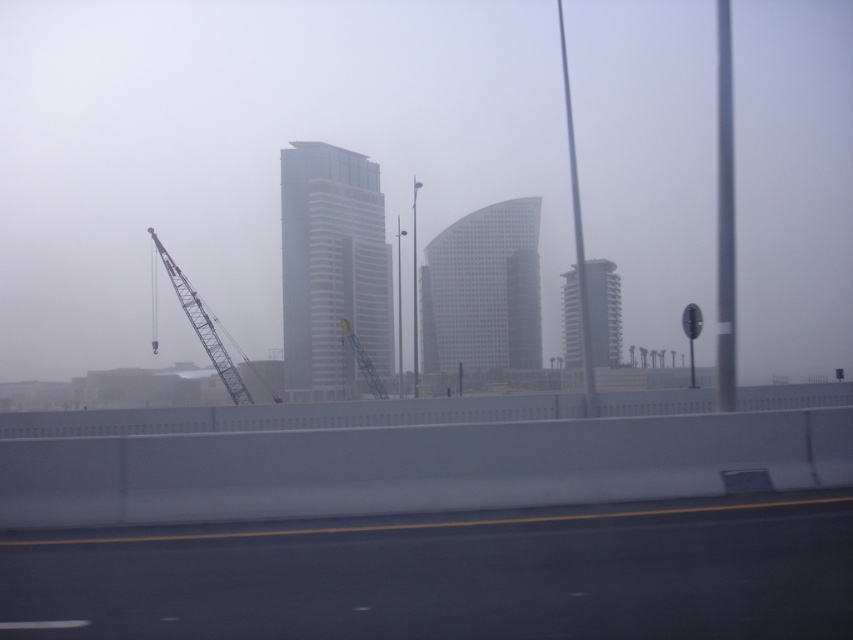
You are a drone operator trying to navigate between two points in the urban scene. The first point is at coordinates point (515,589) and the second is at point (585,278). Which point is closer to the observer based on their positions?

Point (515,589) is in front of point (585,278), so it is closer to the observer.

You are a city planner reviewing this urban scene. You need to determine if the clear glass building at center can be seen entirely from the vantage point of the metallic blue crane at left. Based on their sizes, can you confirm this?

The clear glass building at center has a smaller size compared to metallic blue crane at left, so it is possible that the entire clear glass building at center can be seen from the metallic blue crane at left since it is smaller and likely positioned within the crane operator s line of sight.